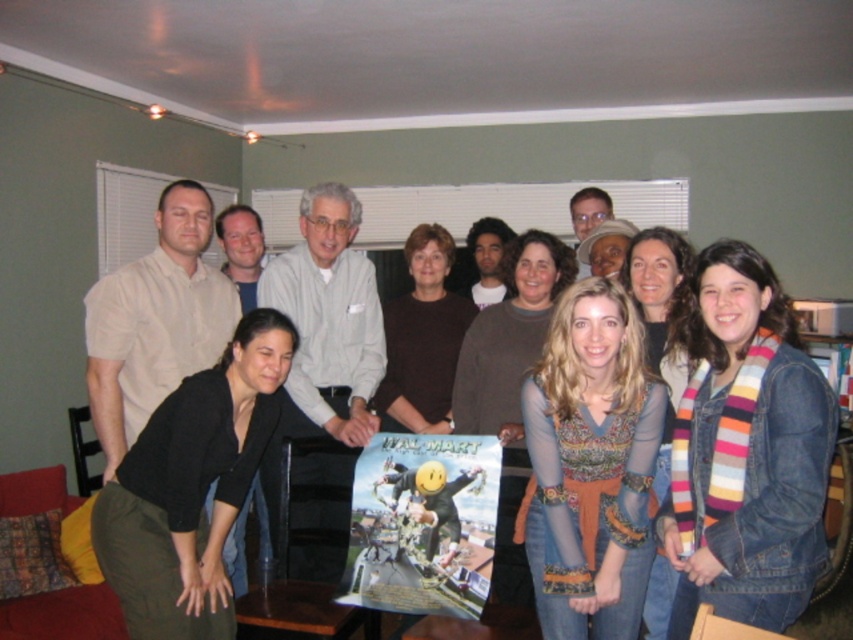
Does multicolored sheer blouse at center have a larger size compared to printed fabric sweater at center?

No, multicolored sheer blouse at center is not bigger than printed fabric sweater at center.

From the picture: Who is more forward, [601,349] or [474,342]?

Point [601,349]

At what (x,y) coordinates should I click in order to perform the action: click on multicolored sheer blouse at center. Please return your answer as a coordinate pair (x, y). This screenshot has width=853, height=640. Looking at the image, I should click on (590, 465).

Is black matte pants at lower left below striped scarf at center?

Yes, black matte pants at lower left is below striped scarf at center.

This screenshot has height=640, width=853. What do you see at coordinates (190, 486) in the screenshot? I see `black matte pants at lower left` at bounding box center [190, 486].

Describe the element at coordinates (190, 486) in the screenshot. I see `black matte pants at lower left` at that location.

At what (x,y) coordinates should I click in order to perform the action: click on black matte pants at lower left. Please return your answer as a coordinate pair (x, y). The image size is (853, 640). Looking at the image, I should click on (190, 486).

Is multicolored sheer blouse at center to the left of brown matte sweater at center from the viewer's perspective?

Incorrect, multicolored sheer blouse at center is not on the left side of brown matte sweater at center.

Who is more distant from viewer, (569, 609) or (386, 419)?

The point (386, 419) is behind.

Identify the location of multicolored sheer blouse at center. This screenshot has width=853, height=640. 590,465.